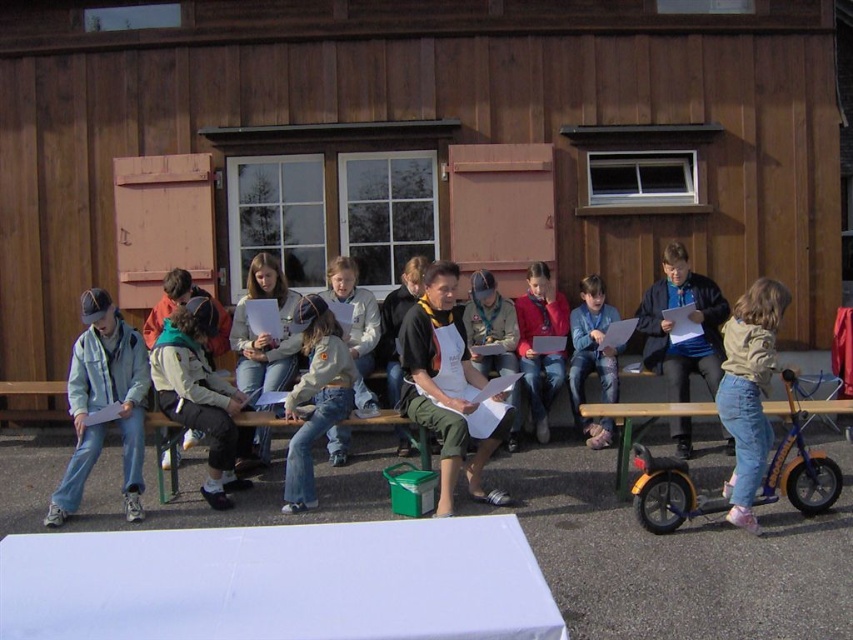
You are a photographer trying to capture a group photo of the jeans at center and the orange plastic picnic table at lower right. Since you want both subjects to appear balanced in the frame, which object should you place closer to the camera?

The jeans at center is much taller than the orange plastic picnic table at lower right, so to balance their sizes in the photo, you should place the orange plastic picnic table at lower right closer to the camera.

You are organizing a small outdoor gathering and need to seat everyone comfortably. You have a wooden bench at center and a denim jacket at left. Which object can accommodate more people for seating?

The wooden bench at center is larger in size than the denim jacket at left, so it can accommodate more people for seating.

You are a photographer trying to capture a group photo of the jeans at center and the orange plastic picnic table at lower right. Which object should you focus on first if you want to ensure both are in the frame without moving the camera?

The orange plastic picnic table at lower right is larger than the jeans at center, so you should focus on the orange plastic picnic table at lower right first to ensure it fits in the frame, and the smaller jeans at center will naturally be included.